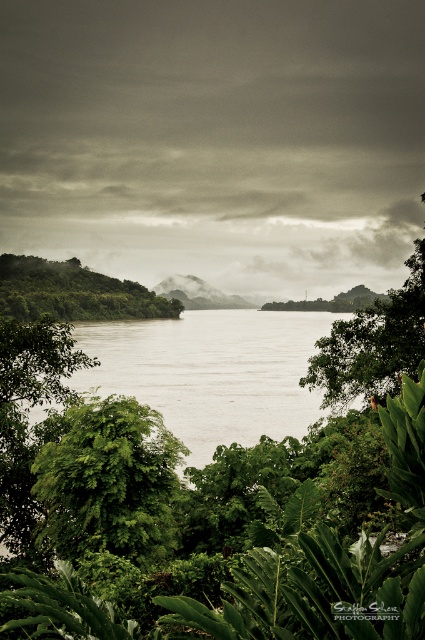
Between green leafy tree at lower left and green leafy tree at center-right, which one has more height?

Standing taller between the two is green leafy tree at center-right.

Can you confirm if green leafy tree at lower left is positioned to the left of green leafy tree at center-right?

Correct, you'll find green leafy tree at lower left to the left of green leafy tree at center-right.

Who is more forward, (53, 470) or (374, 387)?

Positioned in front is point (53, 470).

Find the location of a particular element. This screenshot has width=425, height=640. green leafy tree at lower left is located at coordinates (107, 481).

Is green leafy tree at lower left in front of green leafy trees at left?

Yes, it is.

Is green leafy tree at lower left smaller than green leafy trees at left?

Yes.

The image size is (425, 640). Identify the location of green leafy tree at lower left. (107, 481).

I want to click on green leafy tree at lower left, so click(x=107, y=481).

Who is positioned more to the left, green leafy tree at center-right or green leafy trees at left?

green leafy trees at left is more to the left.

The height and width of the screenshot is (640, 425). Describe the element at coordinates (374, 342) in the screenshot. I see `green leafy tree at center-right` at that location.

This screenshot has width=425, height=640. In order to click on green leafy tree at center-right in this screenshot , I will do `click(374, 342)`.